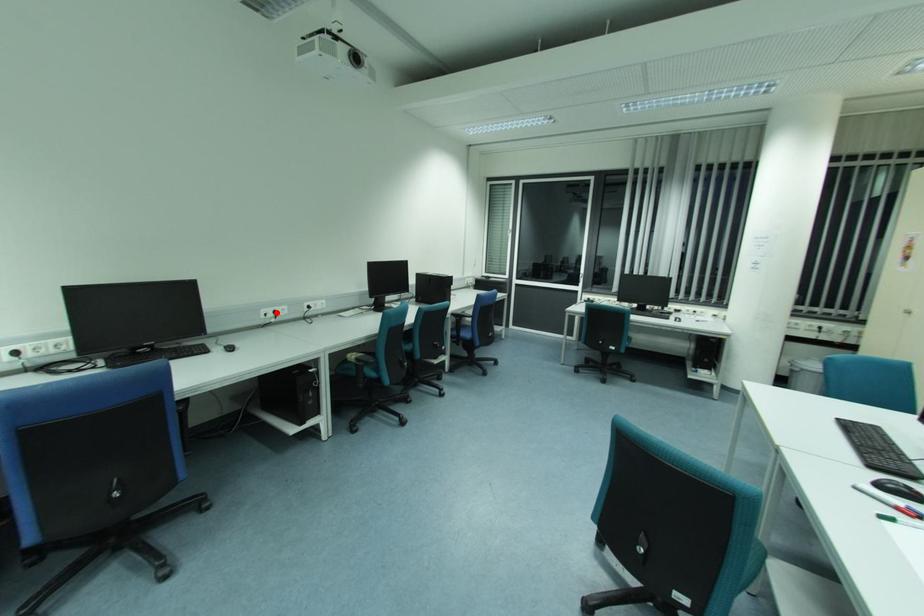
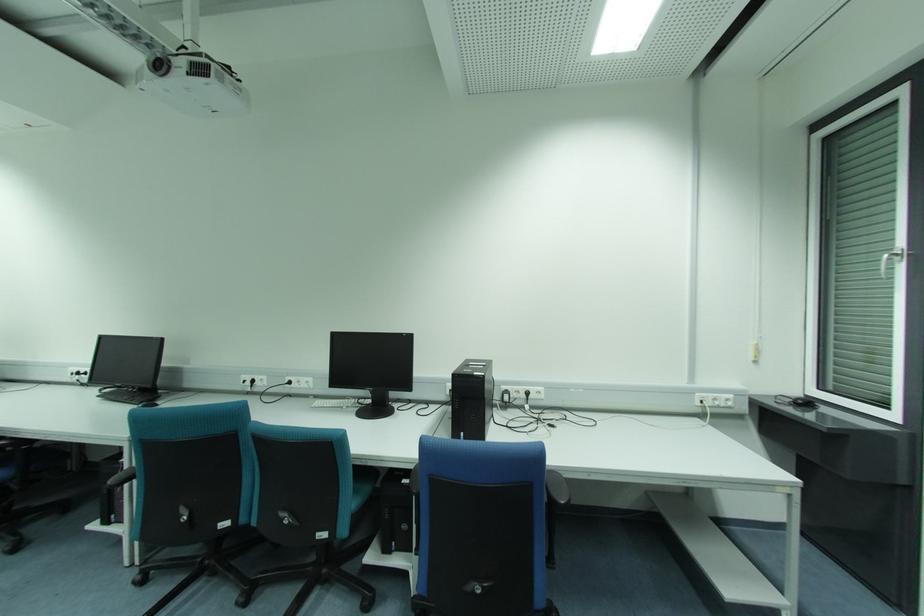
Locate, in the second image, the point that corresponds to the highlighted location in the first image.

(253, 381)